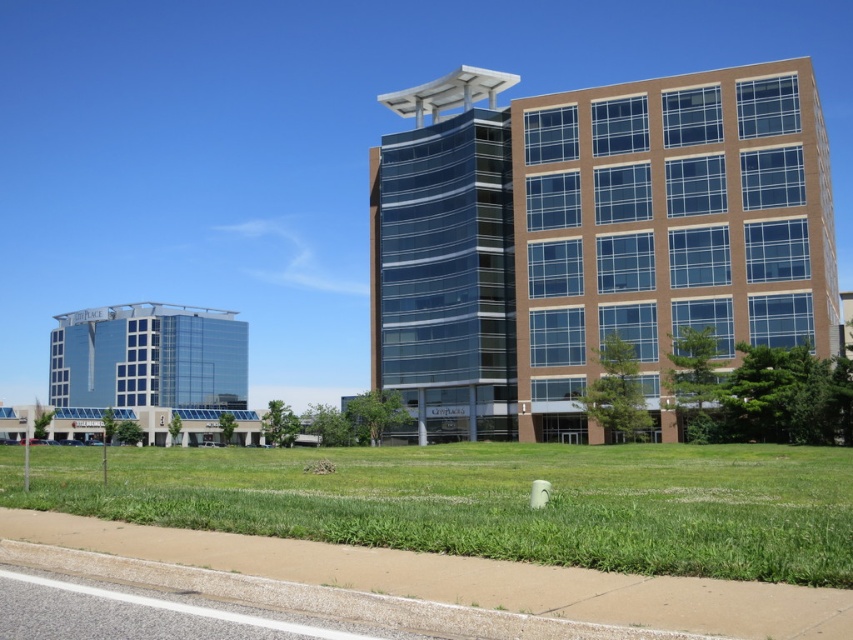
Question: Is brown glass building at center to the right of green grass at lower center from the viewer's perspective?

Choices:
 (A) yes
 (B) no

Answer: (A)

Question: Is brown glass building at center above green grass at lower center?

Choices:
 (A) no
 (B) yes

Answer: (B)

Question: Among these points, which one is farthest from the camera?

Choices:
 (A) (514, 470)
 (B) (457, 307)

Answer: (B)

Question: Which point is farther to the camera?

Choices:
 (A) brown glass building at center
 (B) green grass at lower center

Answer: (A)

Question: Can you confirm if brown glass building at center is wider than green grass at lower center?

Choices:
 (A) no
 (B) yes

Answer: (B)